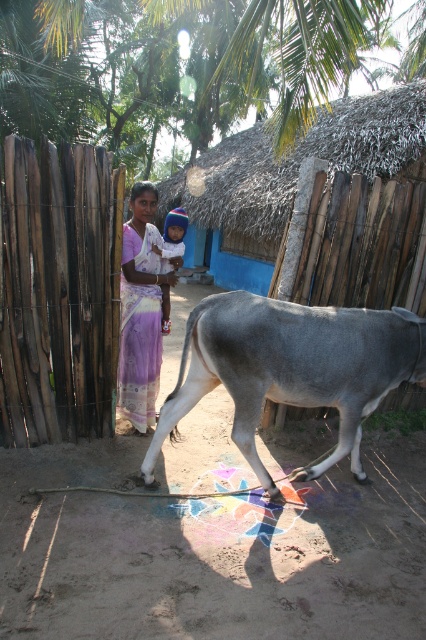
Does purple silk saree at center appear on the right side of blue knitted hat at center?

In fact, purple silk saree at center is to the left of blue knitted hat at center.

Is point (135, 282) positioned behind point (170, 241)?

No, it is in front of (170, 241).

Between point (126, 404) and point (176, 237), which one is positioned behind?

Point (176, 237)

Locate an element on the screen. purple silk saree at center is located at coordinates (141, 310).

Can you confirm if gray matte cow at center is wider than purple silk saree at center?

Correct, the width of gray matte cow at center exceeds that of purple silk saree at center.

Which is below, gray matte cow at center or purple silk saree at center?

Positioned lower is gray matte cow at center.

Which is behind, point (394, 312) or point (135, 428)?

Positioned behind is point (135, 428).

The image size is (426, 640). In order to click on gray matte cow at center in this screenshot , I will do `click(290, 369)`.

Which is in front, point (178, 401) or point (172, 246)?

Positioned in front is point (178, 401).

Is point (331, 461) less distant than point (161, 308)?

That is True.

Locate an element on the screen. This screenshot has width=426, height=640. gray matte cow at center is located at coordinates (290, 369).